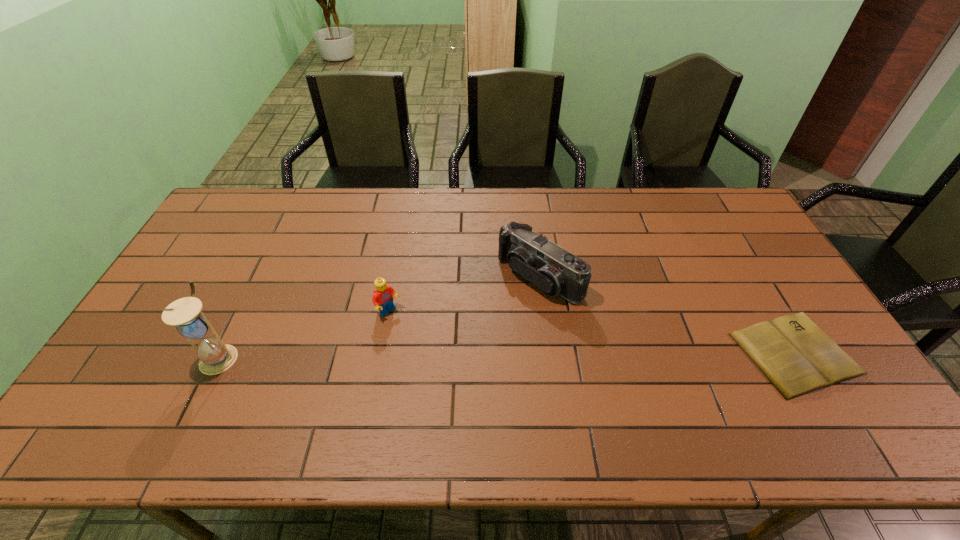
The width and height of the screenshot is (960, 540). In order to click on blank area located on the face of the second object from left to right in this screenshot , I will do `click(478, 390)`.

The height and width of the screenshot is (540, 960). Find the location of `vacant space located 0.240m on the face of the second object from left to right`. vacant space located 0.240m on the face of the second object from left to right is located at coordinates (456, 371).

Locate an element on the screen. free region located on the front-facing side of the third object from left to right is located at coordinates (406, 380).

This screenshot has width=960, height=540. In order to click on free space located 0.400m on the front-facing side of the third object from left to right in this screenshot , I will do `click(402, 382)`.

Find the location of a particular element. The image size is (960, 540). free spot located 0.230m on the front-facing side of the third object from left to right is located at coordinates (453, 343).

The image size is (960, 540). I want to click on hourglass at the near edge, so click(215, 357).

You are a GUI agent. You are given a task and a screenshot of the screen. Output one action in this format:
    pyautogui.click(x=<x>, y=<y>)
    Task: Click on the book that is positioned at the near edge
    The width and height of the screenshot is (960, 540).
    Given the screenshot: What is the action you would take?
    pyautogui.click(x=795, y=355)

Find the location of a particular element. The image size is (960, 540). object present at the right edge is located at coordinates (795, 355).

Identify the location of object at the near right corner. (795, 355).

In the image, there is a desktop. Identify the location of free space at the far edge. Image resolution: width=960 pixels, height=540 pixels. (389, 201).